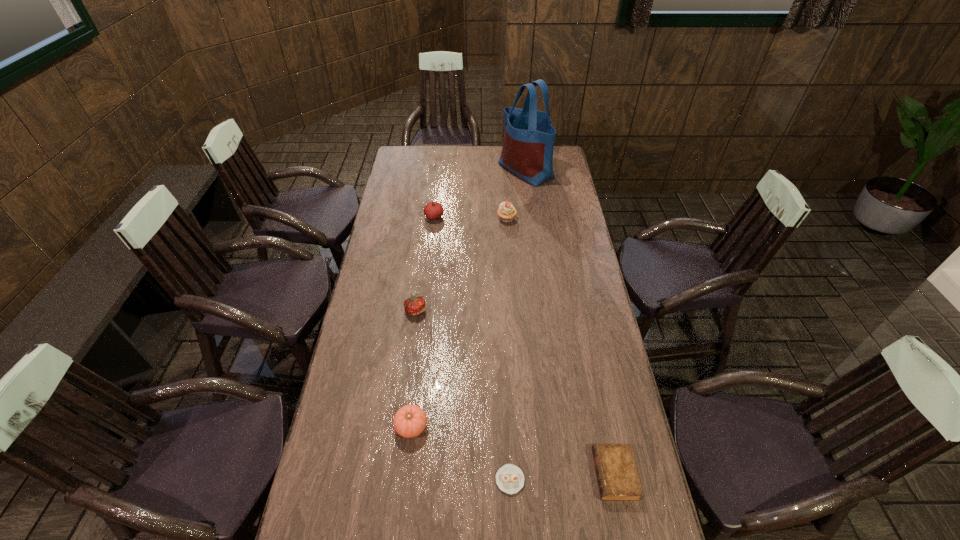
Find the location of `free space that is in between the diary and the taller cupcake`. free space that is in between the diary and the taller cupcake is located at coordinates (561, 347).

You are a GUI agent. You are given a task and a screenshot of the screen. Output one action in this format:
    pyautogui.click(x=<x>, y=<y>)
    Task: Click on the free spot between the nearer cupcake and the sixth tallest object
    The width and height of the screenshot is (960, 540).
    Given the screenshot: What is the action you would take?
    pyautogui.click(x=563, y=477)

This screenshot has width=960, height=540. I want to click on free point between the tallest tomato and the shorter cupcake, so click(x=472, y=348).

Locate an element on the screen. blank region between the taller cupcake and the fifth farthest object is located at coordinates (459, 323).

Where is `free point between the fourth farthest object and the nearest tomato`? The width and height of the screenshot is (960, 540). free point between the fourth farthest object and the nearest tomato is located at coordinates (414, 368).

I want to click on free point between the nearest tomato and the diary, so click(x=513, y=450).

Where is `free space between the shorter cupcake and the second farthest tomato`? The width and height of the screenshot is (960, 540). free space between the shorter cupcake and the second farthest tomato is located at coordinates (463, 395).

The image size is (960, 540). Identify the location of free space between the diary and the fifth farthest object. (513, 450).

Where is `the second closest object to the fifth farthest object`? This screenshot has height=540, width=960. the second closest object to the fifth farthest object is located at coordinates (414, 305).

At what (x,y) coordinates should I click in order to perform the action: click on object that is the third closest one to the second tallest object. Please return your answer as a coordinate pair (x, y). Looking at the image, I should click on (414, 305).